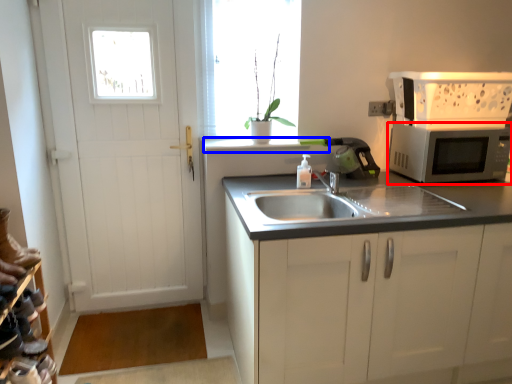
Question: Which object is closer to the camera taking this photo, microwave oven (highlighted by a red box) or window sill (highlighted by a blue box)?

Choices:
 (A) microwave oven
 (B) window sill

Answer: (A)